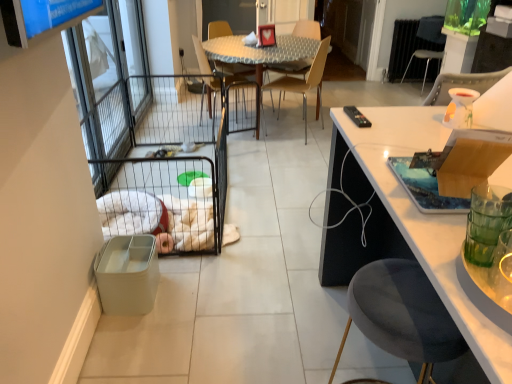
This screenshot has height=384, width=512. What are the coordinates of `vacant space situated above wooden cutting board at right (from a real-world perspective)` in the screenshot? It's located at (441, 173).